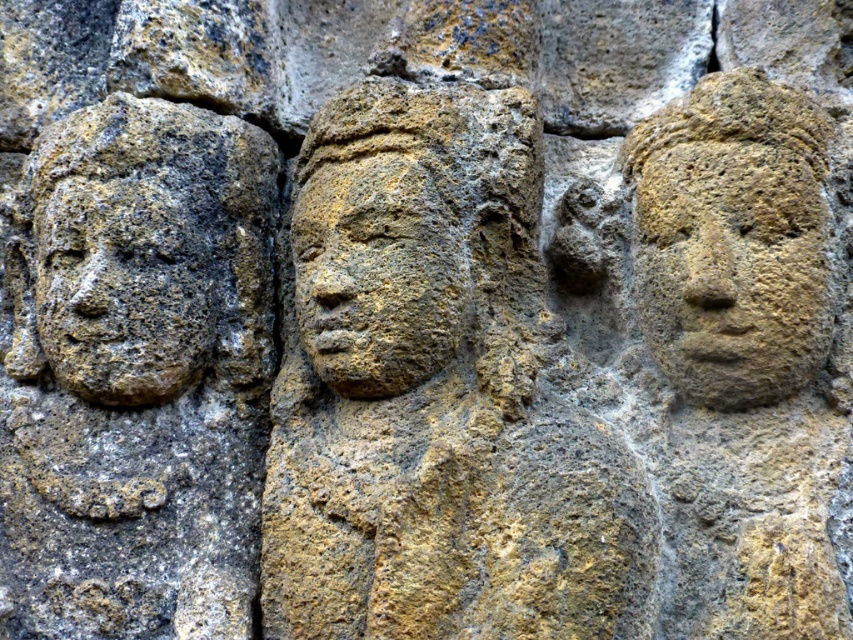
Can you confirm if yellow stone face at center is positioned below earthy stone carving at left?

Yes, yellow stone face at center is below earthy stone carving at left.

Identify the location of yellow stone face at center. The image size is (853, 640). (436, 394).

Based on the photo, can you confirm if yellow stone face at center is wider than rough stone face at right?

Yes.

Is yellow stone face at center shorter than rough stone face at right?

No.

Which is behind, point (541, 321) or point (670, 195)?

Point (541, 321)

Identify the location of yellow stone face at center. (436, 394).

Who is taller, earthy stone carving at left or rough stone face at right?

rough stone face at right is taller.

Does earthy stone carving at left have a lesser width compared to rough stone face at right?

No, earthy stone carving at left is not thinner than rough stone face at right.

In order to click on earthy stone carving at left in this screenshot , I will do `click(152, 248)`.